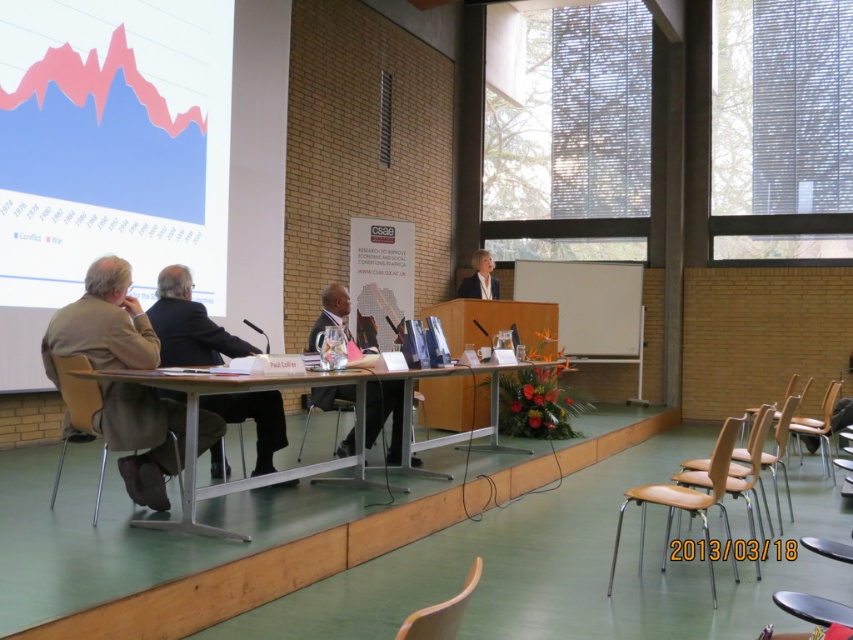
Question: Which of the following is the closest to the observer?

Choices:
 (A) (115, 410)
 (B) (178, 484)

Answer: (A)

Question: Is wooden table at center positioned in front of brown wooden chair at right?

Choices:
 (A) yes
 (B) no

Answer: (A)

Question: Which of the following is the closest to the observer?

Choices:
 (A) matte white projection screen at upper left
 (B) metallic silver chair at lower right
 (C) wooden chair at lower left

Answer: (B)

Question: Is dark suit at center further to camera compared to wooden chair at lower right?

Choices:
 (A) yes
 (B) no

Answer: (A)

Question: Among these points, which one is nearest to the camera?

Choices:
 (A) (807, 438)
 (B) (344, 310)
 (C) (424, 636)
 (D) (790, 392)

Answer: (C)

Question: Can you confirm if matte white projection screen at upper left is positioned to the left of light brown wood chair at lower center?

Choices:
 (A) yes
 (B) no

Answer: (A)